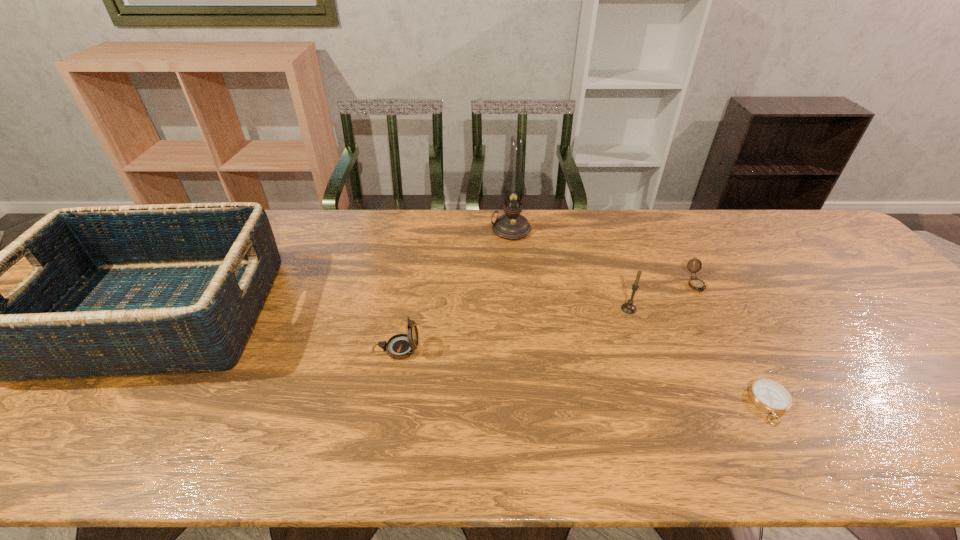
Find the location of a particular element. The image size is (960, 540). the farthest object is located at coordinates (510, 226).

The width and height of the screenshot is (960, 540). What are the coordinates of `oil lamp` in the screenshot? It's located at (510, 226).

This screenshot has height=540, width=960. I want to click on candle, so click(629, 308).

Image resolution: width=960 pixels, height=540 pixels. What are the coordinates of `the fourth shortest object` in the screenshot? It's located at (629, 308).

Where is `the fifth object from right to left`? This screenshot has width=960, height=540. the fifth object from right to left is located at coordinates coord(401,346).

Where is `the second farthest compass`? The image size is (960, 540). the second farthest compass is located at coordinates (401, 346).

This screenshot has height=540, width=960. Identify the location of the farthest compass. (695, 283).

Locate an element on the screen. the second tallest compass is located at coordinates (695, 283).

Find the location of a particular element. The image size is (960, 540). the shortest object is located at coordinates (770, 396).

Find the location of a particular element. the nearest compass is located at coordinates (770, 396).